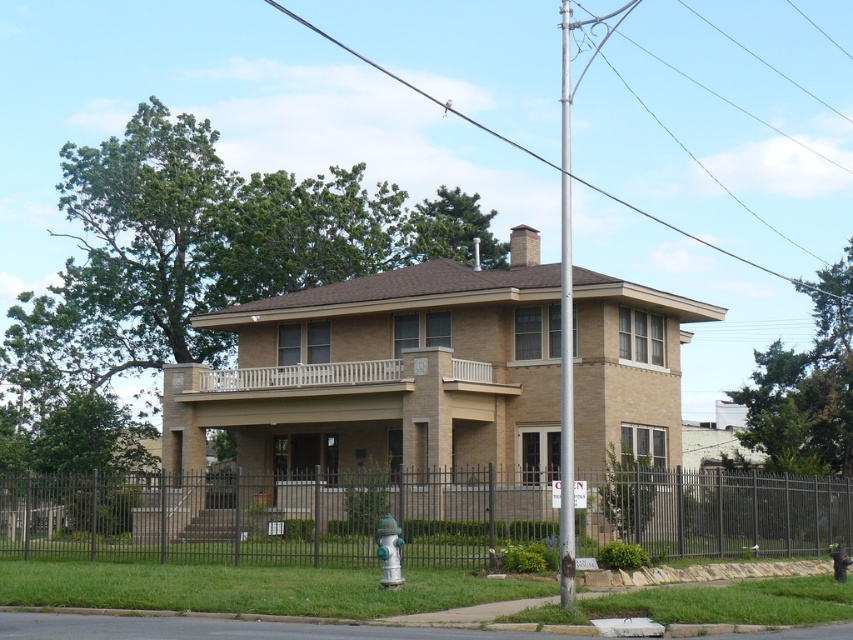
Is black metal fence at lower center positioned in front of metallic wire at upper center?

Yes, black metal fence at lower center is closer to the viewer.

Between black metal fence at lower center and metallic wire at upper center, which one has less height?

black metal fence at lower center is shorter.

Who is more distant from viewer, (293,548) or (811,288)?

The point (811,288) is more distant.

Identify the location of black metal fence at lower center. The height and width of the screenshot is (640, 853). (273, 515).

Is white painted wood pole at center positioned at the back of green metallic hydrant at lower center?

No, white painted wood pole at center is in front of green metallic hydrant at lower center.

Is white painted wood pole at center thinner than green metallic hydrant at lower center?

No.

Is point (564, 209) positioned behind point (393, 582)?

That is True.

Where is `white painted wood pole at center`? white painted wood pole at center is located at coordinates (566, 332).

Is white wood railing at upper center further to the viewer compared to metallic wire at upper center?

No.

The width and height of the screenshot is (853, 640). What are the coordinates of `white wood railing at upper center` in the screenshot? It's located at (306, 378).

Does point (322, 380) lie behind point (674, 227)?

No, (322, 380) is closer to viewer.

Identify the location of white wood railing at upper center. This screenshot has width=853, height=640. (306, 378).